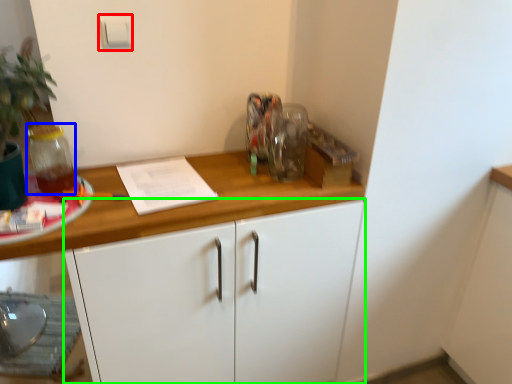
Question: Which object is positioned farthest from light switch (highlighted by a red box)? Select from glass jar (highlighted by a blue box) and cabinetry (highlighted by a green box).

Choices:
 (A) glass jar
 (B) cabinetry

Answer: (B)